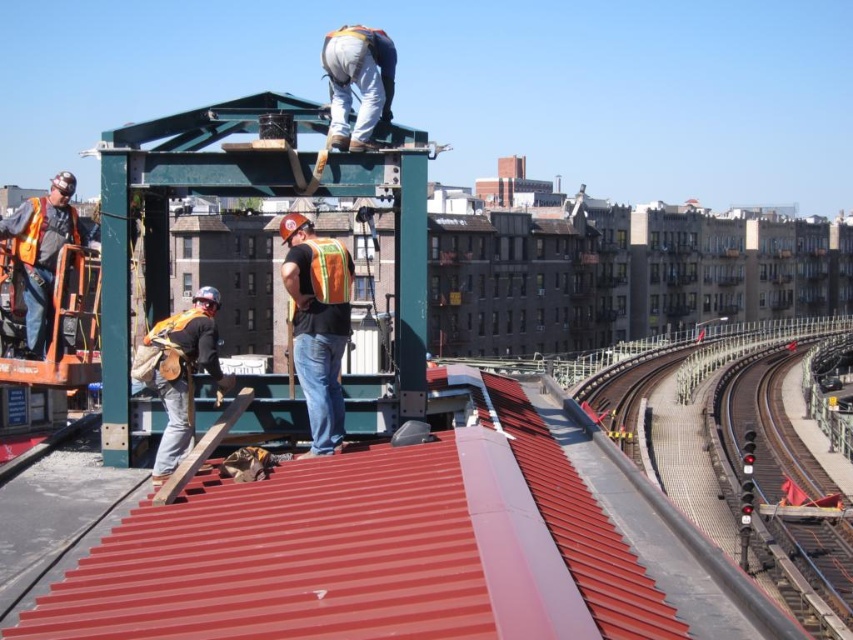
Does point (811, 570) come in front of point (846, 316)?

Yes, it is in front of point (846, 316).

This screenshot has height=640, width=853. I want to click on metallic track at right, so click(x=784, y=492).

Measure the distance between smooth metal track at right and orange reflective safety vest at left.

smooth metal track at right is 114.28 meters away from orange reflective safety vest at left.

Which is below, smooth metal track at right or orange reflective safety vest at left?

smooth metal track at right is lower down.

The image size is (853, 640). Describe the element at coordinates (634, 356) in the screenshot. I see `smooth metal track at right` at that location.

In order to click on smooth metal track at right in this screenshot , I will do `click(634, 356)`.

Is metallic track at right bigger than orange reflective safety vest at left?

Indeed, metallic track at right has a larger size compared to orange reflective safety vest at left.

Between metallic track at right and orange reflective safety vest at left, which one is positioned lower?

metallic track at right is lower down.

Who is more forward, (755, 468) or (36, 244)?

Point (36, 244)

Where is `metallic track at right`? The width and height of the screenshot is (853, 640). metallic track at right is located at coordinates (784, 492).